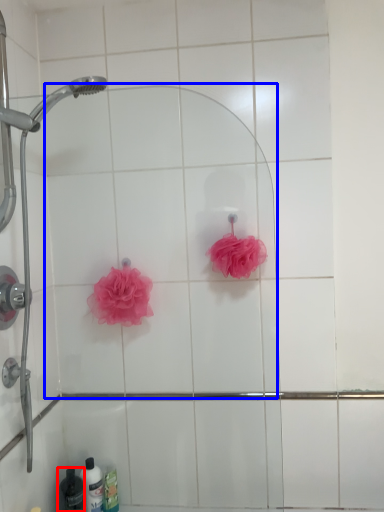
Question: Which object is further to the camera taking this photo, toiletry (highlighted by a red box) or mirror (highlighted by a blue box)?

Choices:
 (A) toiletry
 (B) mirror

Answer: (A)